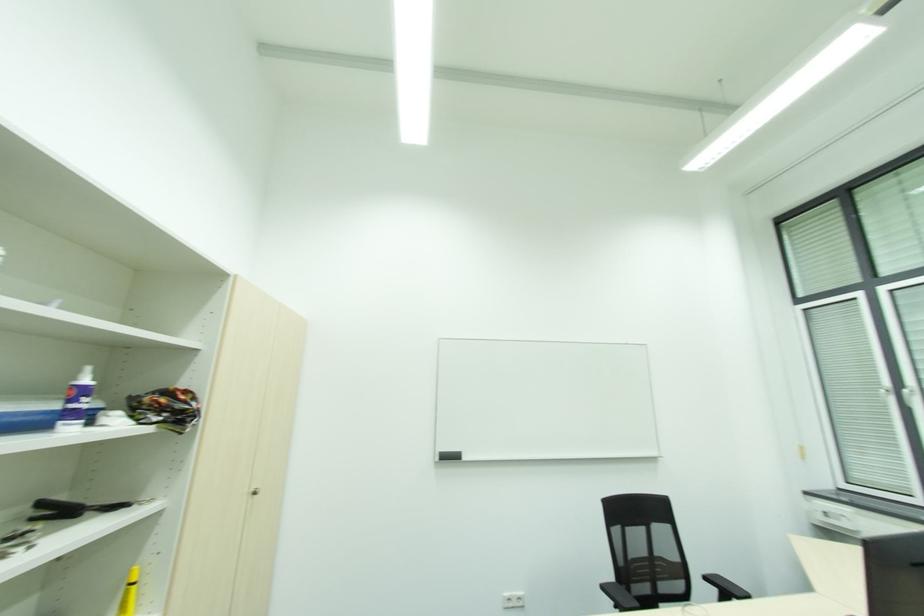
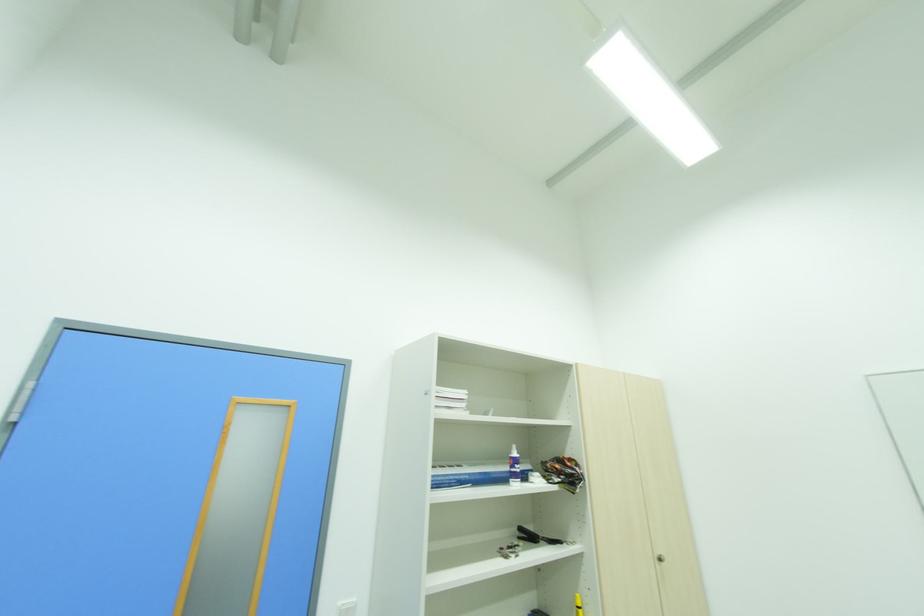
The point at (87,403) is marked in the first image. Where is the corresponding point in the second image?

(520, 469)